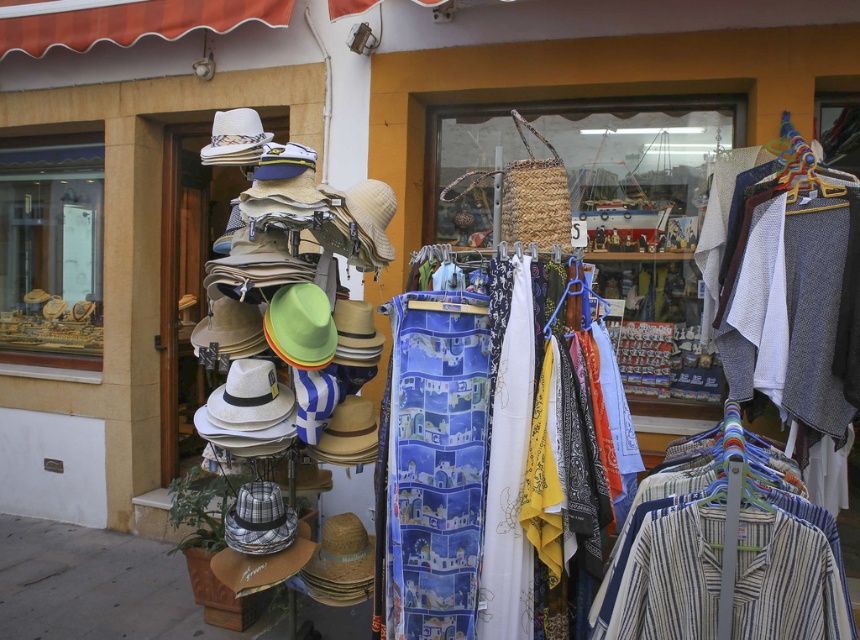
You are a customer at the shop and want to see the gold metallic jewelry at upper left. However, the blue printed scarf at center is blocking your view. Can you move the scarf to get a better look at the jewelry?

The blue printed scarf at center is in front of the gold metallic jewelry at upper left, so moving the scarf would allow you to see the jewelry clearly.